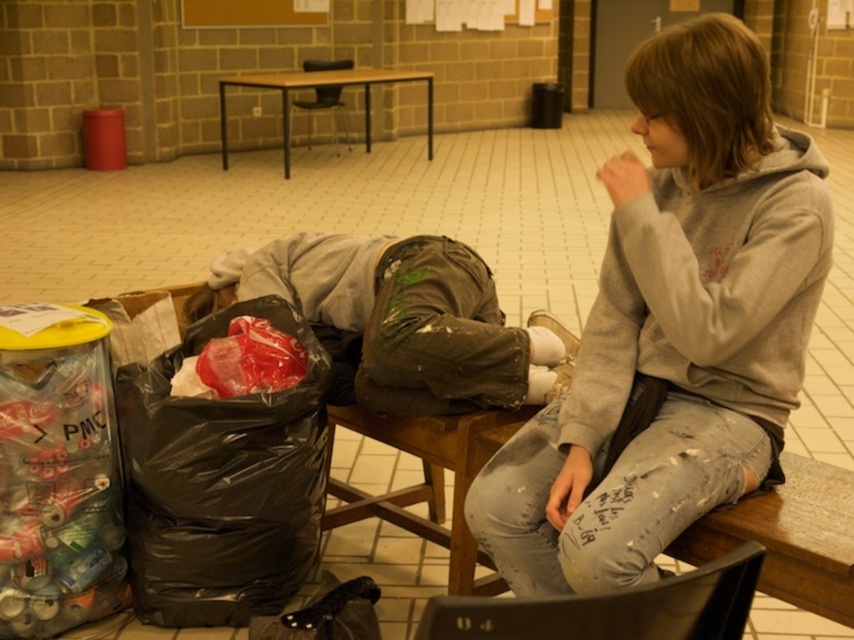
Is point (661, 444) in front of point (69, 422)?

Yes, it is.

Does gray sweatshirt at upper right appear over translucent plastic can at left?

Yes.

Identify the location of gray sweatshirt at upper right. (671, 328).

The height and width of the screenshot is (640, 854). In order to click on gray sweatshirt at upper right in this screenshot , I will do `click(671, 328)`.

Can you confirm if translucent plastic can at left is smaller than matte black chair at center?

Yes, translucent plastic can at left is smaller than matte black chair at center.

Looking at this image, does translucent plastic can at left have a lesser height compared to matte black chair at center?

No, translucent plastic can at left is not shorter than matte black chair at center.

Which is behind, point (10, 621) or point (336, 65)?

The point (336, 65) is more distant.

Find the location of a particular element. This screenshot has height=640, width=854. translucent plastic can at left is located at coordinates (57, 476).

What do you see at coordinates (404, 320) in the screenshot? The width and height of the screenshot is (854, 640). I see `dirty gray pants at center` at bounding box center [404, 320].

Who is taller, dirty gray pants at center or black plastic chair at lower center?

dirty gray pants at center

In the scene shown: Who is more distant from viewer, (266,250) or (629,609)?

The point (266,250) is more distant.

Locate an element on the screen. The height and width of the screenshot is (640, 854). dirty gray pants at center is located at coordinates (404, 320).